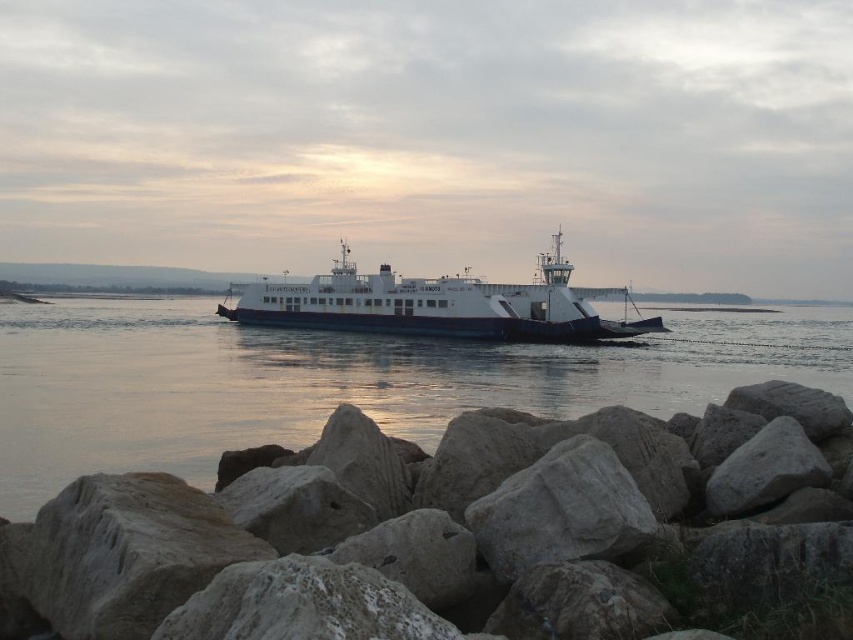
You are standing at the edge of the waterfront scene. You see the gray rock at lower center and the white matte ferry at center. Which object is closer to you?

The gray rock at lower center is closer to you because it is in front of the white matte ferry at center.

You are standing at the edge of the waterfront scene and want to place a small decorative statue exactly between the gray rock at lower center and the smooth water at center. Given their widths, which object will require more space to the left and right of the statue?

The smooth water at center has a greater width than the gray rock at lower center, so it requires more space to the left and right of the statue.